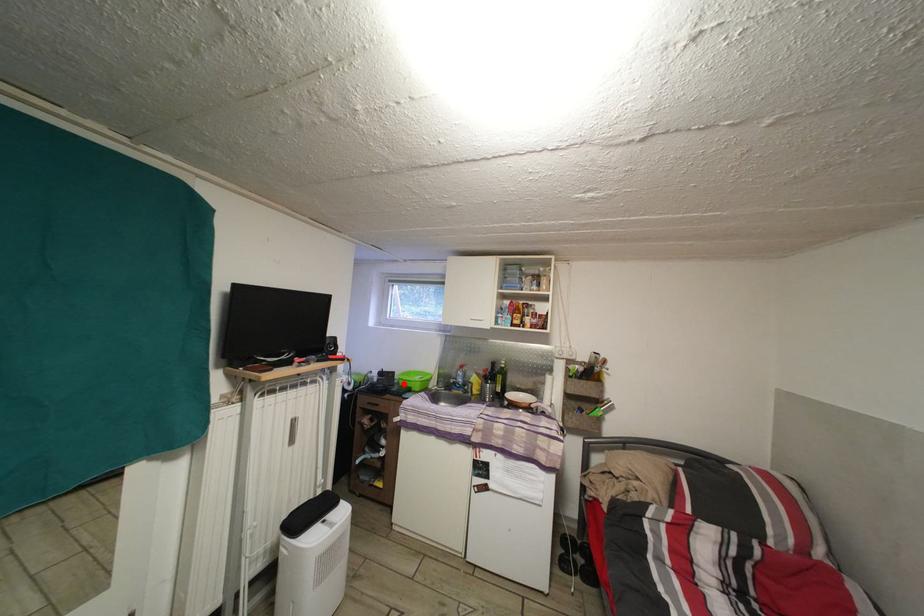
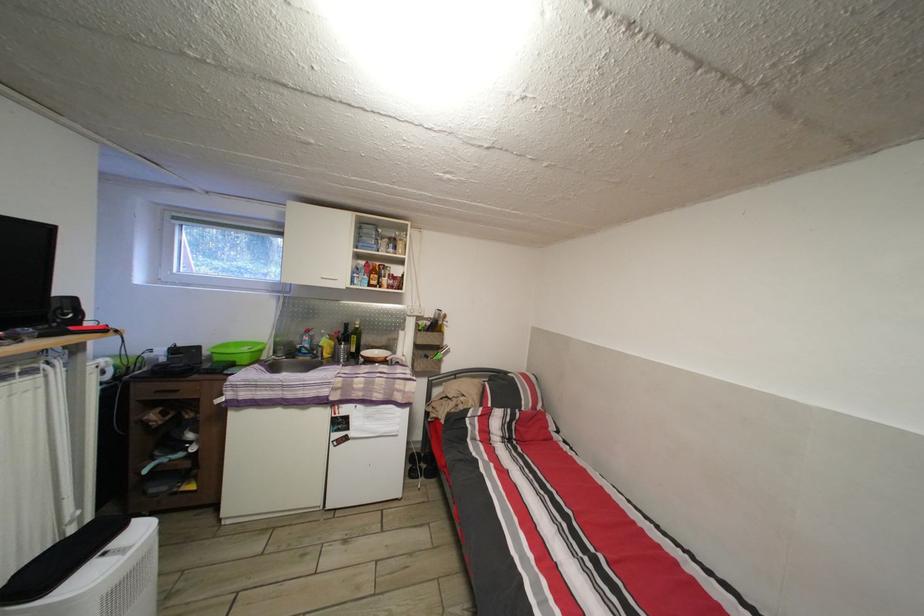
Question: I am providing you with two images of the same scene from different viewpoints. Image1 has a red point marked. In image2, the corresponding 3D location appears at what relative position? Reply with the corresponding letter.

Choices:
 (A) Closer
 (B) Farther

Answer: (A)